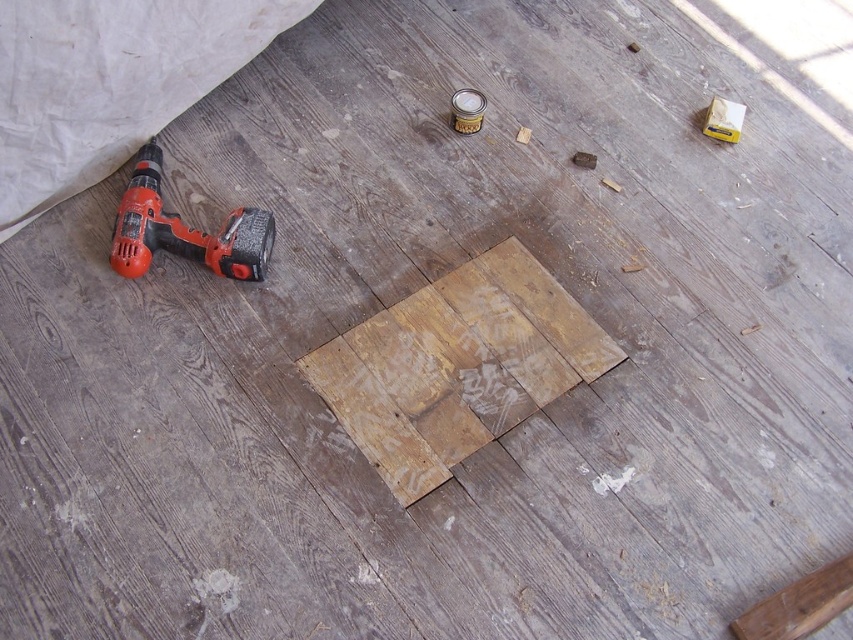
You are standing at the square area where the flooring has been partially removed. You see two points marked on the floor labeled as point (532, 278) and point (267, 257). Which point is closer to you?

Point (267, 257) is closer to you because it is in front of point (532, 278), which is behind it.

You need to place the orange plastic drill at lower left on top of the weathered wood plank at center. Will it fit without overhanging?

The weathered wood plank at center might be wider than orange plastic drill at lower left, so there is a possibility that the orange plastic drill at lower left will fit without overhanging, but it is uncertain due to the comparative width not being definitively stated.

You are a contractor assessing the renovation site. You see the weathered wood plank at center and the orange plastic drill at lower left. Which object takes up more space in the image?

The weathered wood plank at center has a larger size compared to the orange plastic drill at lower left, so it takes up more space in the image.